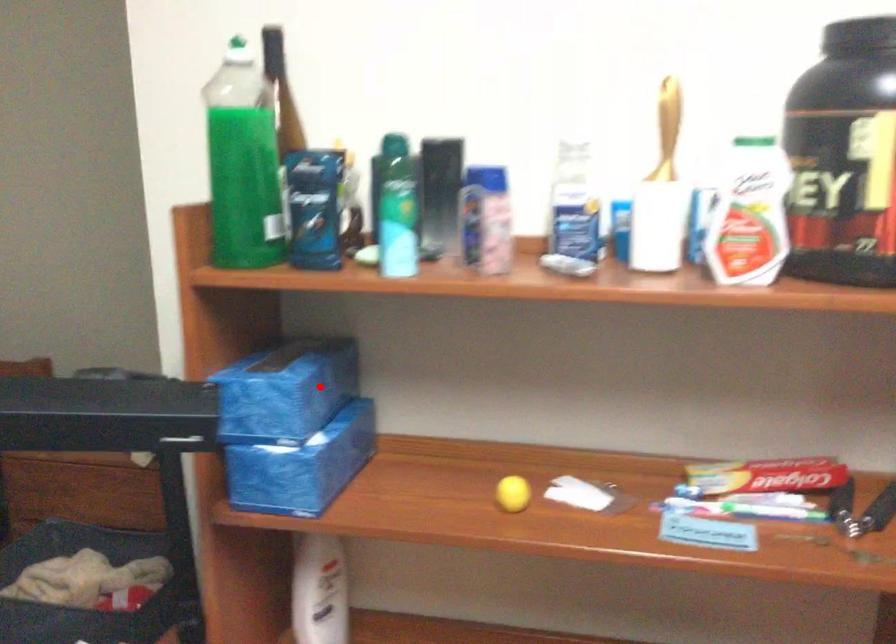
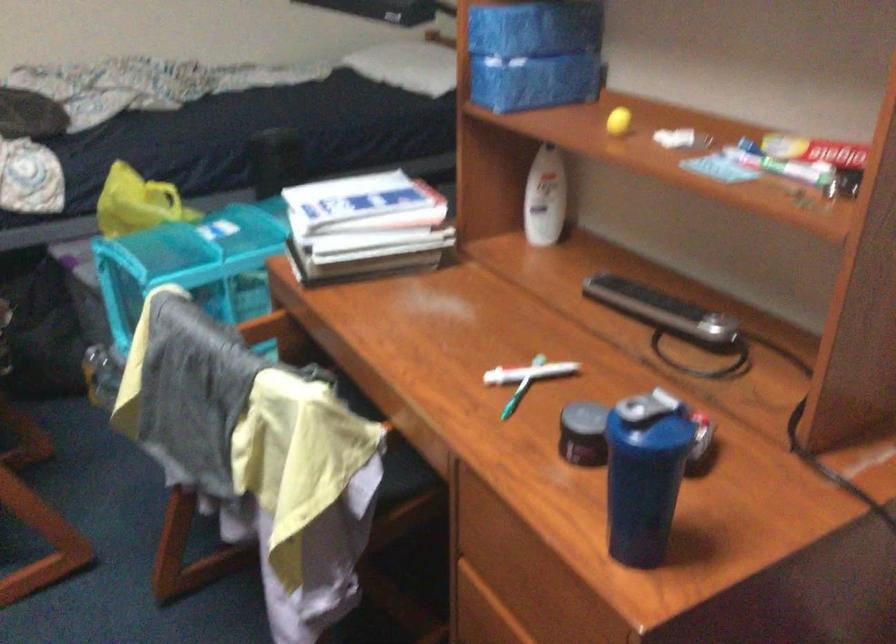
Question: I am providing you with two images of the same scene from different viewpoints. A red point is shown in image1. For the corresponding object point in image2, is it positioned nearer or farther from the camera?

Choices:
 (A) Nearer
 (B) Farther

Answer: (B)